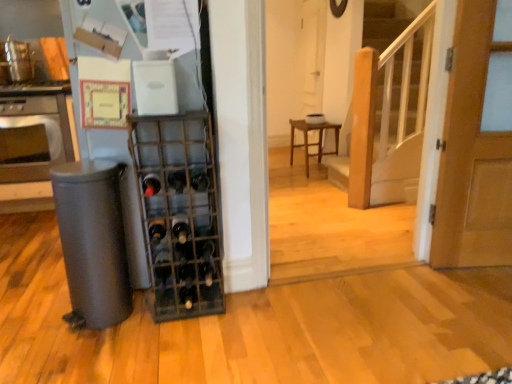
Question: From the image's perspective, does translucent glass wine bottle at center, placed as the 2th wine bottle when sorted from bottom to top, appear lower than black glass wine bottle at center, which appears as the first wine bottle when viewed from the top?

Choices:
 (A) no
 (B) yes

Answer: (B)

Question: Can you see translucent glass wine bottle at center, placed as the fourth wine bottle when sorted from top to bottom, touching black glass wine bottle at center, which appears as the first wine bottle when viewed from the top?

Choices:
 (A) no
 (B) yes

Answer: (A)

Question: Is translucent glass wine bottle at center, placed as the fourth wine bottle when sorted from top to bottom, to the right of black glass wine bottle at center, which ranks as the fifth wine bottle in bottom-to-top order, from the viewer's perspective?

Choices:
 (A) no
 (B) yes

Answer: (A)

Question: Is translucent glass wine bottle at center, placed as the fourth wine bottle when sorted from top to bottom, closer to the viewer compared to black glass wine bottle at center, which ranks as the fifth wine bottle in bottom-to-top order?

Choices:
 (A) yes
 (B) no

Answer: (B)

Question: Does translucent glass wine bottle at center, placed as the fourth wine bottle when sorted from top to bottom, have a larger size compared to black glass wine bottle at center, which appears as the first wine bottle when viewed from the top?

Choices:
 (A) no
 (B) yes

Answer: (A)

Question: Is wooden stool at center spatially inside black glass wine bottle at center, which ranks as the fifth wine bottle in bottom-to-top order, or outside of it?

Choices:
 (A) outside
 (B) inside

Answer: (A)

Question: Is wooden stool at center taller or shorter than black glass wine bottle at center, which ranks as the fifth wine bottle in bottom-to-top order?

Choices:
 (A) short
 (B) tall

Answer: (B)

Question: Is wooden stool at center bigger or smaller than black glass wine bottle at center, which appears as the first wine bottle when viewed from the top?

Choices:
 (A) big
 (B) small

Answer: (A)

Question: Is wooden stool at center in front of or behind black glass wine bottle at center, which ranks as the fifth wine bottle in bottom-to-top order, in the image?

Choices:
 (A) behind
 (B) front

Answer: (A)

Question: Is black glass wine bottle at center, which appears as the first wine bottle when viewed from the top, inside or outside of matte gray trash can at left, which ranks as the 2th appliance in top-to-bottom order?

Choices:
 (A) outside
 (B) inside

Answer: (A)

Question: From a real-world perspective, is black glass wine bottle at center, which appears as the first wine bottle when viewed from the top, above or below matte gray trash can at left, the first appliance ordered from the bottom?

Choices:
 (A) below
 (B) above

Answer: (A)

Question: Considering the positions of black glass wine bottle at center, which appears as the first wine bottle when viewed from the top, and matte gray trash can at left, the first appliance ordered from the bottom, in the image, is black glass wine bottle at center, which appears as the first wine bottle when viewed from the top, bigger or smaller than matte gray trash can at left, the first appliance ordered from the bottom,?

Choices:
 (A) big
 (B) small

Answer: (B)

Question: Is point (204, 170) closer or farther from the camera than point (221, 301)?

Choices:
 (A) farther
 (B) closer

Answer: (A)

Question: In terms of height, does white matte switch at upper center, which ranks as the second appliance in bottom-to-top order, look taller or shorter compared to satin silver oven at left?

Choices:
 (A) short
 (B) tall

Answer: (A)

Question: Is point (157, 94) positioned closer to the camera than point (33, 104)?

Choices:
 (A) closer
 (B) farther

Answer: (A)